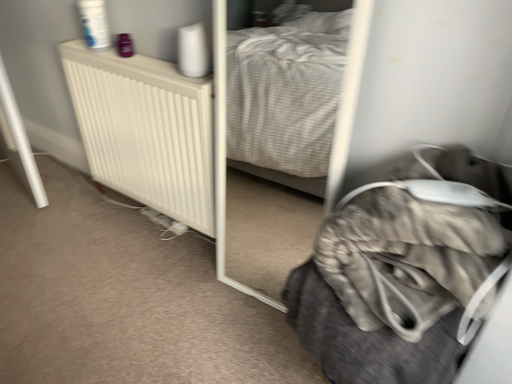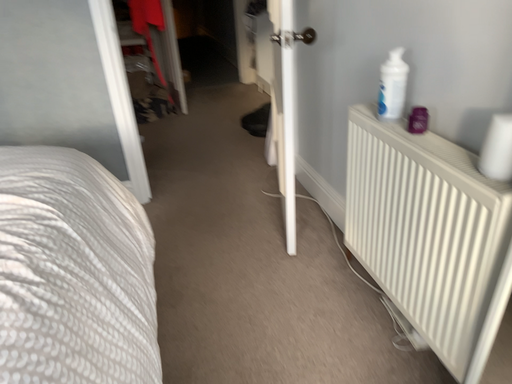
Question: How did the camera likely rotate when shooting the video?

Choices:
 (A) rotated left
 (B) rotated right

Answer: (A)